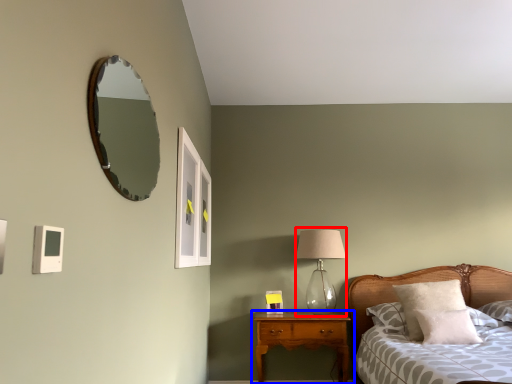
Question: Which of the following is the closest to the observer, table lamp (highlighted by a red box) or nightstand (highlighted by a blue box)?

Choices:
 (A) table lamp
 (B) nightstand

Answer: (B)